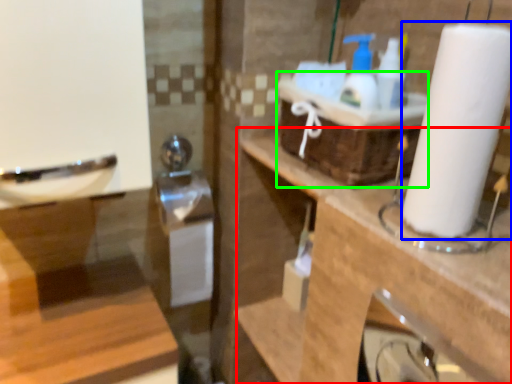
Question: Estimate the real-world distances between objects in this image. Which object is closer to counter top (highlighted by a red box), paper towel (highlighted by a blue box) or basket (highlighted by a green box)?

Choices:
 (A) paper towel
 (B) basket

Answer: (B)